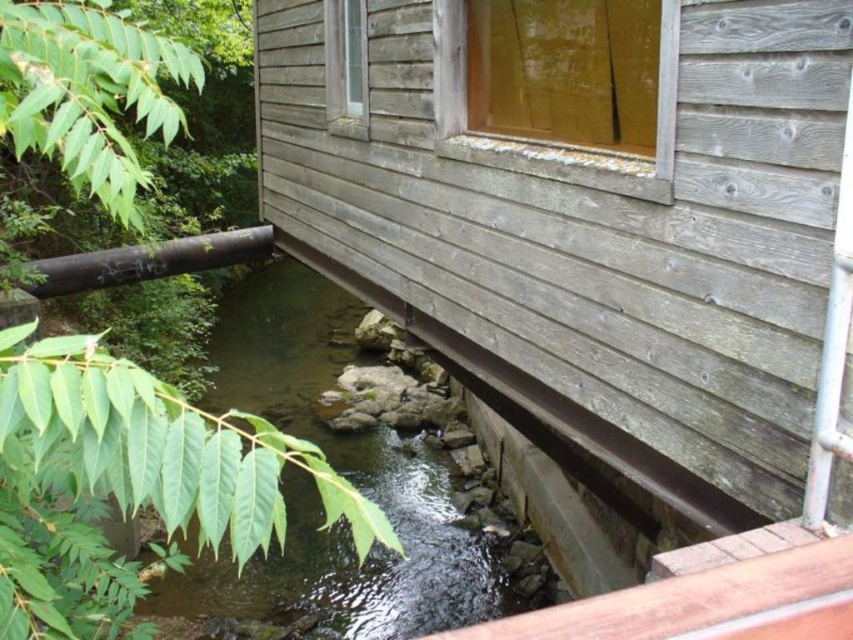
You are standing in front of the rustic wooden structure and want to determine the position of two points marked on the building. Which point, point (430, 563) or point (263, 225), is closer to your current position?

Point (430, 563) is closer to the camera than point (263, 225), so it is closer to your current position.

You are a hiker who wants to cross the stream near the cabin. You see the clear water at center and the black metal pipe at lower left. Which object is closer to you as you stand on the bank?

The clear water at center is closer to you because it is in front of the black metal pipe at lower left, meaning it is positioned nearer to your viewpoint.

You are a maintenance worker inspecting the rustic wooden structure. You notice the clear water at center and the black metal pipe at lower left. Based on their positions, which object is closer to the ground?

The clear water at center is located below the black metal pipe at lower left, so the clear water at center is closer to the ground.